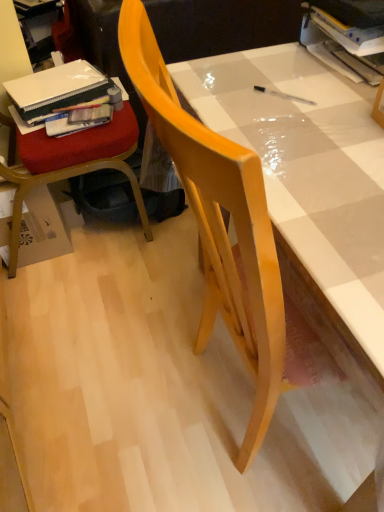
At what (x,y) coordinates should I click in order to perform the action: click on free region on the left part of matte plastic book at upper right, the 1th book when ordered from right to left. Please return your answer as a coordinate pair (x, y). Looking at the image, I should click on (270, 70).